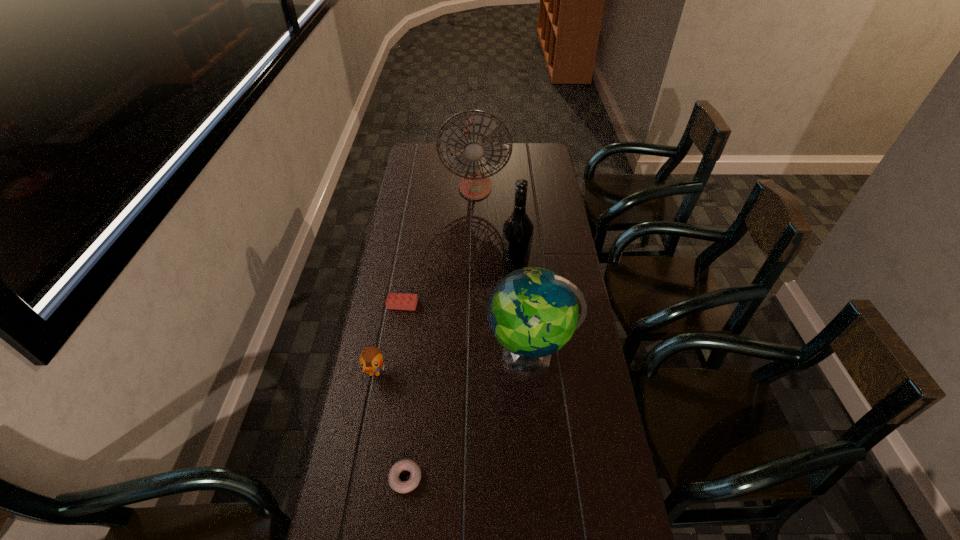
The width and height of the screenshot is (960, 540). What are the coordinates of `free space between the farthest object and the duck` in the screenshot? It's located at (424, 280).

The width and height of the screenshot is (960, 540). Identify the location of free space between the nearest object and the farthest object. (441, 332).

The image size is (960, 540). In order to click on vacant region between the globe and the third shortest object in this screenshot , I will do `click(453, 364)`.

Where is `free space between the globe and the Lego`? Image resolution: width=960 pixels, height=540 pixels. free space between the globe and the Lego is located at coordinates (467, 330).

This screenshot has width=960, height=540. In order to click on object that is the third closest to the shortest object in this screenshot , I will do `click(400, 301)`.

Identify which object is the fourth closest to the globe. Please provide its 2D coordinates. Your answer should be formatted as a tuple, i.e. [(x, y)], where the tuple contains the x and y coordinates of a point satisfying the conditions above.

[(371, 359)]

Locate an element on the screen. vacant position in the image that satisfies the following two spatial constraints: 1. on the front side of the third farthest object; 2. on the left side of the shortest object is located at coordinates (374, 478).

What are the coordinates of `vacant position in the image that satisfies the following two spatial constraints: 1. on the front surface of the globe; 2. on the front-facing side of the fourth tallest object` in the screenshot? It's located at (533, 374).

The height and width of the screenshot is (540, 960). Find the location of `vacant area in the image that satisfies the following two spatial constraints: 1. on the front surface of the globe; 2. on the front-facing side of the fourth tallest object`. vacant area in the image that satisfies the following two spatial constraints: 1. on the front surface of the globe; 2. on the front-facing side of the fourth tallest object is located at coordinates (533, 374).